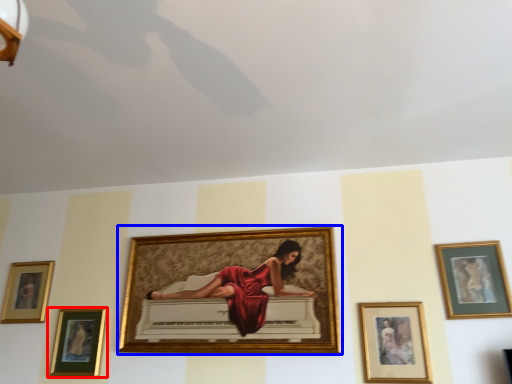
Question: Which point is further to the camera, picture frame (highlighted by a red box) or picture frame (highlighted by a blue box)?

Choices:
 (A) picture frame
 (B) picture frame

Answer: (A)